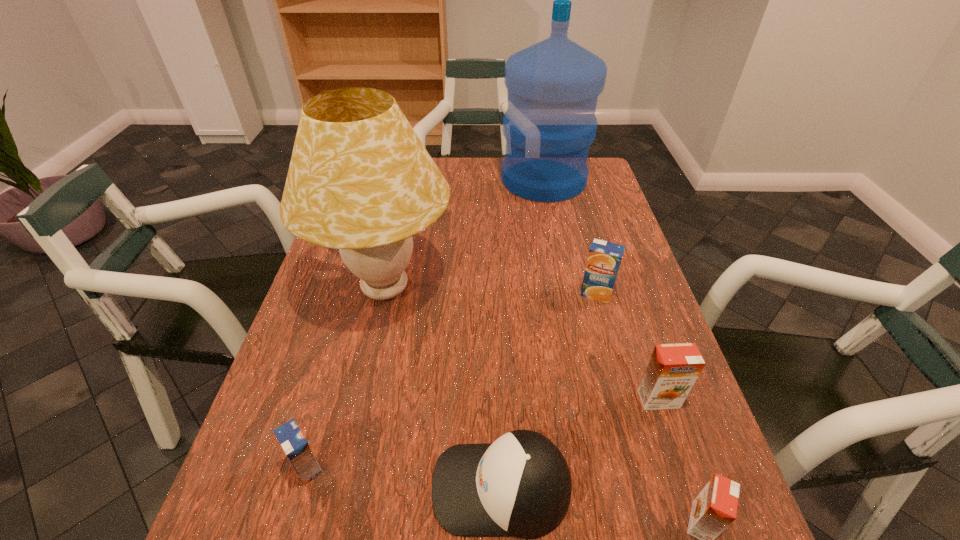
This screenshot has width=960, height=540. I want to click on vacant space located on the front of the water jug, so click(x=556, y=242).

The width and height of the screenshot is (960, 540). I want to click on vacant space situated on the right of the lampshade, so click(585, 288).

I want to click on vacant area located 0.150m on the back of the bigger orange orange juice, so click(x=636, y=330).

Where is `free space located 0.300m on the left of the farther blue orange_juice`? free space located 0.300m on the left of the farther blue orange_juice is located at coordinates (456, 294).

At what (x,y) coordinates should I click in order to perform the action: click on free space located 0.300m on the front panel of the gray cap. Please return your answer as a coordinate pair (x, y). Looking at the image, I should click on (254, 487).

Locate an element on the screen. This screenshot has width=960, height=540. free point located on the front panel of the gray cap is located at coordinates (379, 487).

Image resolution: width=960 pixels, height=540 pixels. Identify the location of vacant space located on the front panel of the gray cap. (373, 487).

What are the coordinates of `blank area located 0.120m on the back of the left blue orange_juice` in the screenshot? It's located at (329, 392).

The image size is (960, 540). Identify the location of object present at the far edge. (553, 86).

This screenshot has height=540, width=960. Find the location of `lampshade present at the left edge`. lampshade present at the left edge is located at coordinates (360, 180).